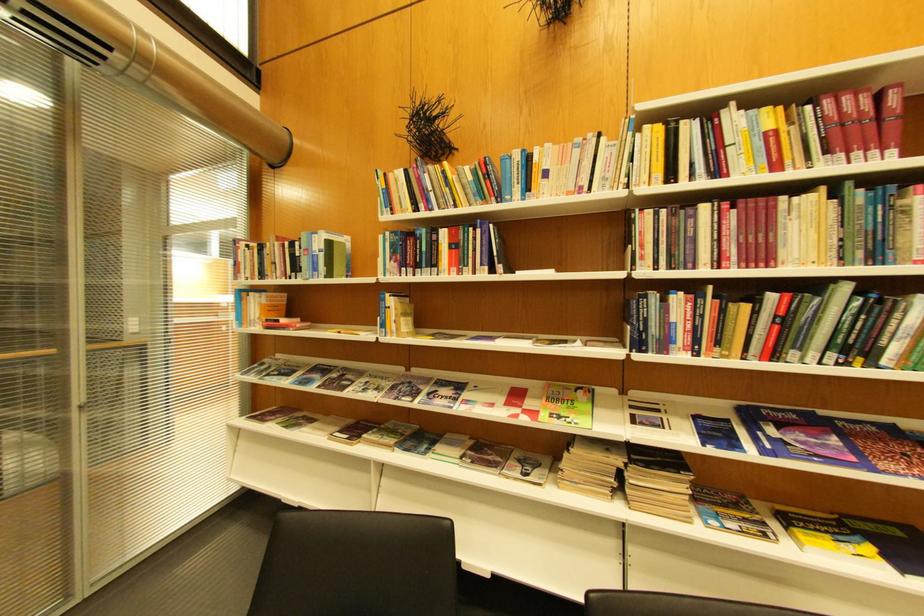
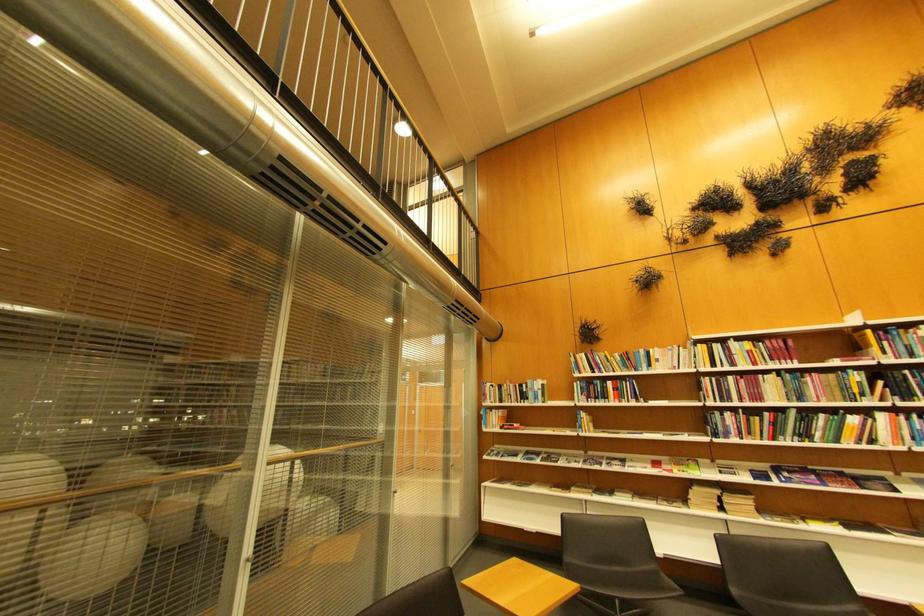
Locate, in the second image, the point that corresponds to (x=404, y=267) in the first image.

(594, 399)